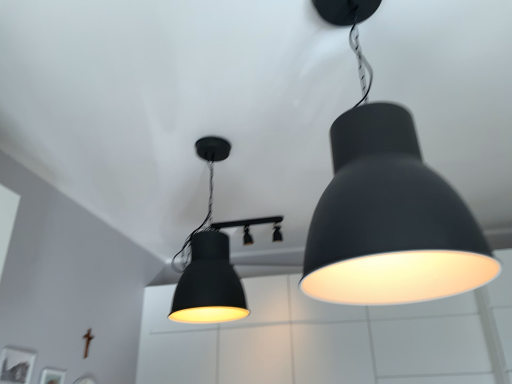
Question: From a real-world perspective, is matte black light fixture at center, the third lamp in the front-to-back sequence, beneath matte black lampshade at upper right, which ranks as the first lamp in front-to-back order?

Choices:
 (A) no
 (B) yes

Answer: (A)

Question: From a real-world perspective, is matte black light fixture at center, marked as the 1th lamp in a back-to-front arrangement, located higher than matte black lampshade at upper right, the third lamp positioned from the back?

Choices:
 (A) yes
 (B) no

Answer: (A)

Question: Is matte black light fixture at center, marked as the 1th lamp in a back-to-front arrangement, positioned with its back to matte black lampshade at upper right, which ranks as the first lamp in front-to-back order?

Choices:
 (A) no
 (B) yes

Answer: (A)

Question: Can you confirm if matte black light fixture at center, the third lamp in the front-to-back sequence, is shorter than matte black lampshade at upper right, the third lamp positioned from the back?

Choices:
 (A) yes
 (B) no

Answer: (A)

Question: Is matte black light fixture at center, marked as the 1th lamp in a back-to-front arrangement, not close to matte black lampshade at upper right, the third lamp positioned from the back?

Choices:
 (A) no
 (B) yes

Answer: (B)

Question: Considering the relative positions of matte black light fixture at center, marked as the 1th lamp in a back-to-front arrangement, and matte black lampshade at upper right, the third lamp positioned from the back, in the image provided, is matte black light fixture at center, marked as the 1th lamp in a back-to-front arrangement, to the left or to the right of matte black lampshade at upper right, the third lamp positioned from the back,?

Choices:
 (A) right
 (B) left

Answer: (B)

Question: Is point (254, 221) closer or farther from the camera than point (400, 284)?

Choices:
 (A) farther
 (B) closer

Answer: (A)

Question: From the image's perspective, is matte black light fixture at center, marked as the 1th lamp in a back-to-front arrangement, located above or below matte black lampshade at upper right, which ranks as the first lamp in front-to-back order?

Choices:
 (A) below
 (B) above

Answer: (A)

Question: Is matte black light fixture at center, marked as the 1th lamp in a back-to-front arrangement, wider or thinner than matte black lampshade at upper right, which ranks as the first lamp in front-to-back order?

Choices:
 (A) thin
 (B) wide

Answer: (B)

Question: From the image's perspective, is matte black lampshade at center, the 2th lamp when ordered from back to front, located above or below matte black light fixture at center, the third lamp in the front-to-back sequence?

Choices:
 (A) above
 (B) below

Answer: (A)

Question: Based on their sizes in the image, would you say matte black lampshade at center, the 2th lamp when ordered from back to front, is bigger or smaller than matte black light fixture at center, the third lamp in the front-to-back sequence?

Choices:
 (A) small
 (B) big

Answer: (B)

Question: Would you say matte black lampshade at center, the 2th lamp when ordered from back to front, is inside or outside matte black light fixture at center, marked as the 1th lamp in a back-to-front arrangement?

Choices:
 (A) outside
 (B) inside

Answer: (A)

Question: From their relative heights in the image, would you say matte black lampshade at center, the 2th lamp when ordered from back to front, is taller or shorter than matte black light fixture at center, the third lamp in the front-to-back sequence?

Choices:
 (A) short
 (B) tall

Answer: (B)

Question: In the image, is matte black lampshade at upper right, which ranks as the first lamp in front-to-back order, positioned in front of or behind matte black light fixture at center, marked as the 1th lamp in a back-to-front arrangement?

Choices:
 (A) behind
 (B) front

Answer: (B)

Question: Is matte black lampshade at upper right, the third lamp positioned from the back, bigger or smaller than matte black light fixture at center, the third lamp in the front-to-back sequence?

Choices:
 (A) big
 (B) small

Answer: (A)